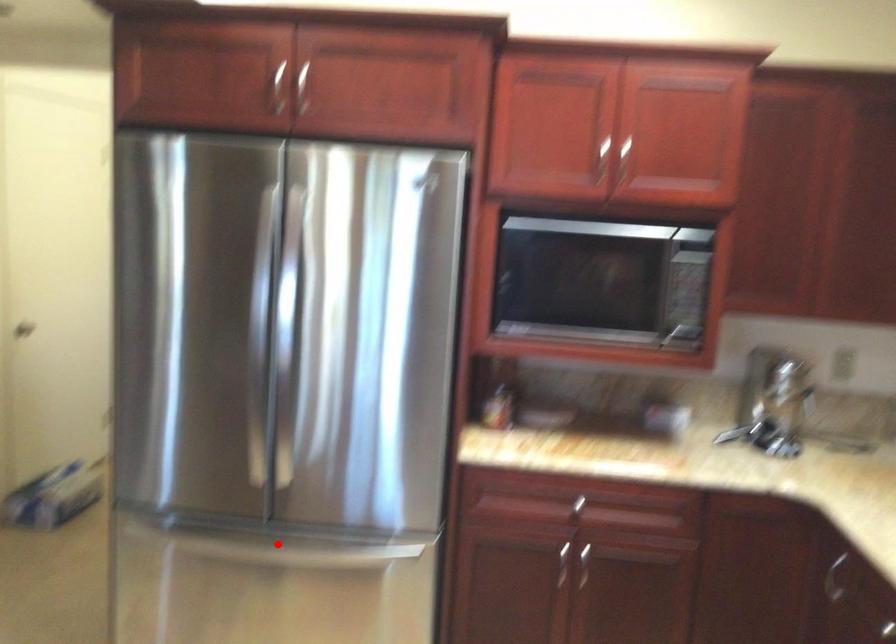
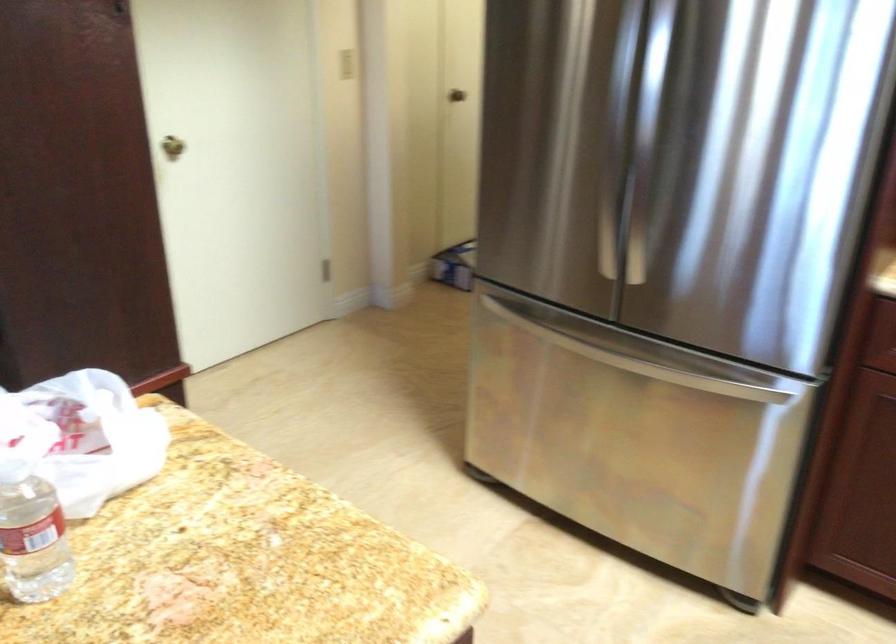
Locate, in the second image, the point that corresponds to the highlighted location in the first image.

(607, 355)